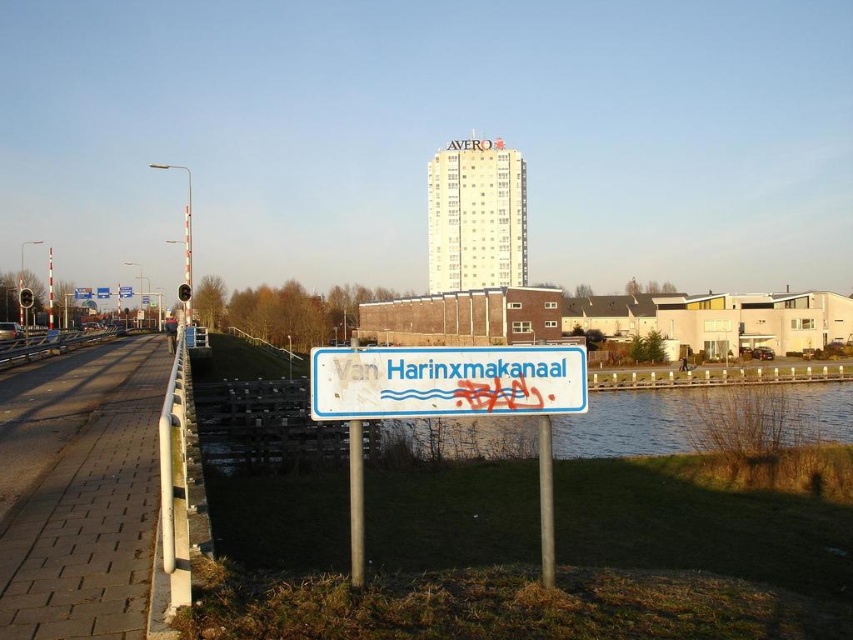
Question: Which of the following is the farthest from the observer?

Choices:
 (A) metallic pole at center
 (B) white plastic sign at center
 (C) metallic gray pole at center

Answer: (C)

Question: Is metallic pole at center behind metallic gray pole at center?

Choices:
 (A) no
 (B) yes

Answer: (A)

Question: Which object is the closest to the metallic pole at center?

Choices:
 (A) white plastic sign at center
 (B) metallic gray pole at center

Answer: (A)

Question: From the image, what is the correct spatial relationship of metallic pole at center in relation to metallic gray pole at center?

Choices:
 (A) below
 (B) above

Answer: (A)

Question: Is metallic pole at center to the left of metallic gray pole at center from the viewer's perspective?

Choices:
 (A) yes
 (B) no

Answer: (A)

Question: Which object is the closest to the metallic gray pole at center?

Choices:
 (A) metallic pole at center
 (B) white plastic sign at center

Answer: (B)